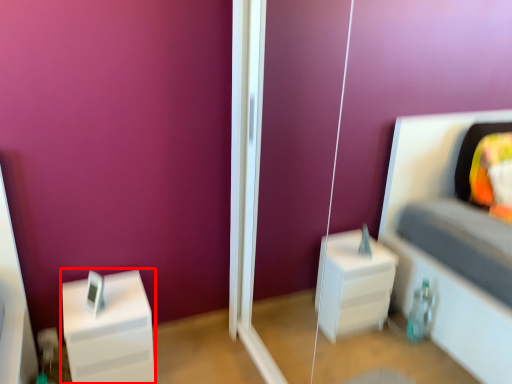
Question: From the image, what is the correct spatial relationship of furniture (annotated by the red box) in relation to glass door?

Choices:
 (A) right
 (B) left

Answer: (B)